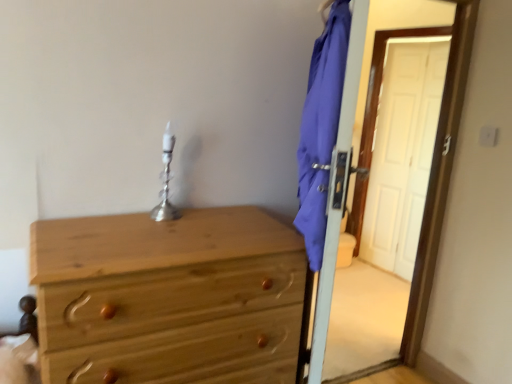
Find the location of a particular element. vacant space to the right of silver metallic table lamp at center is located at coordinates (210, 219).